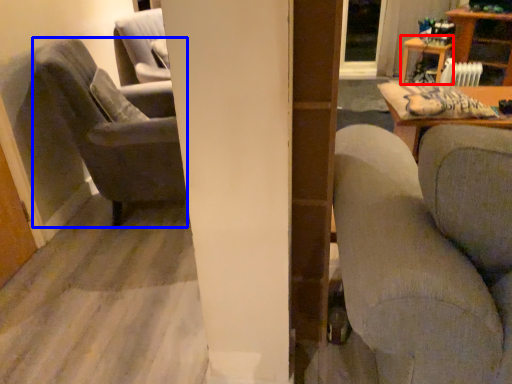
Question: Which of the following is the closest to the observer, table (highlighted by a red box) or chair (highlighted by a blue box)?

Choices:
 (A) table
 (B) chair

Answer: (B)